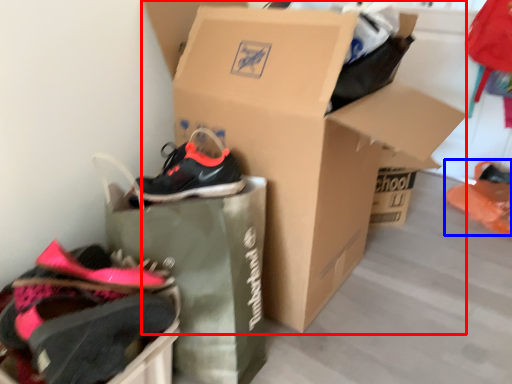
Question: Which object appears farthest to the camera in this image, box (highlighted by a red box) or footwear (highlighted by a blue box)?

Choices:
 (A) box
 (B) footwear

Answer: (B)